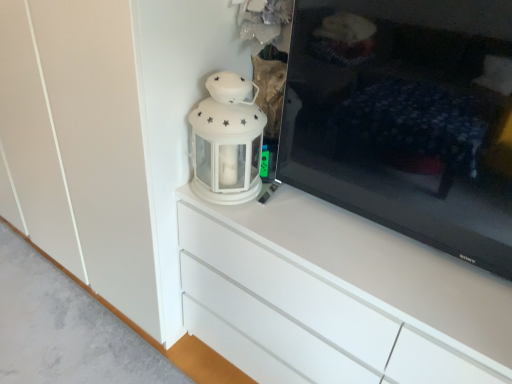
Locate an element on the screen. The height and width of the screenshot is (384, 512). vacant area located to the right-hand side of white glossy lantern at upper center is located at coordinates (279, 207).